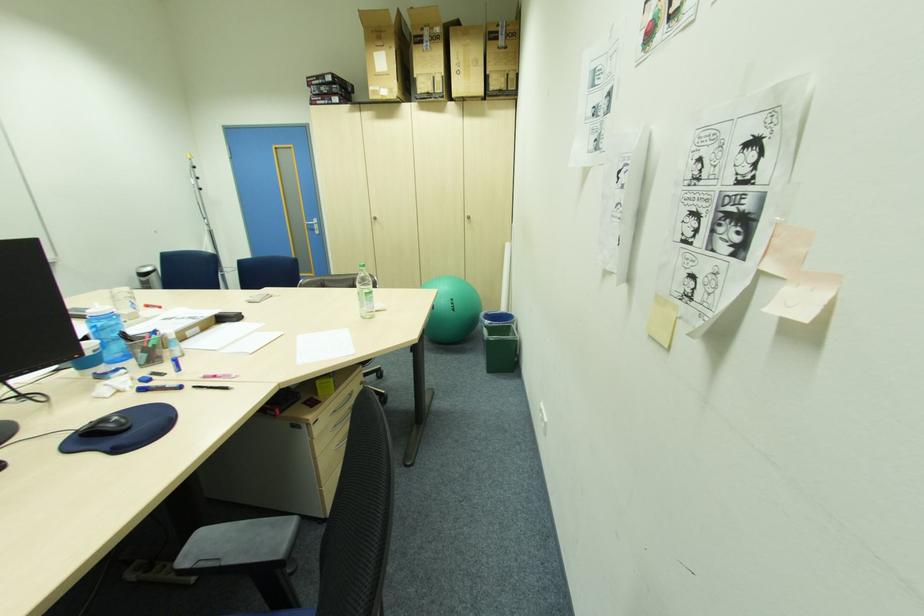
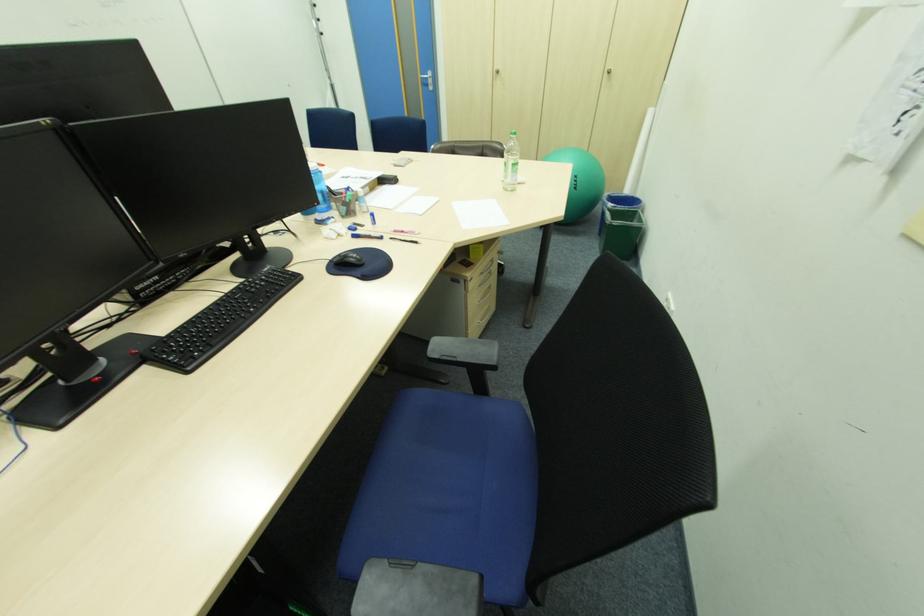
In the second image, find the point that corresponds to the point at 495,323 in the first image.

(621, 207)